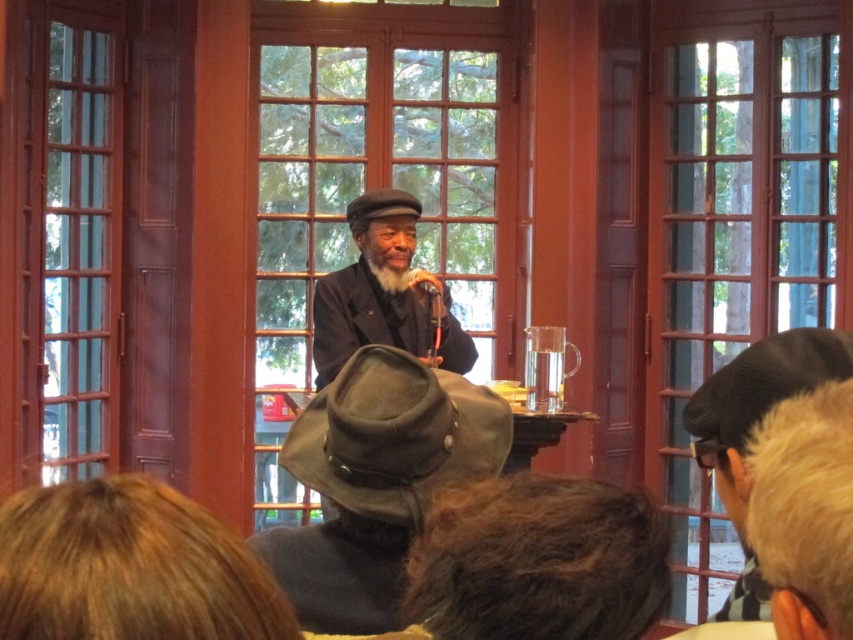
You are an event planner trying to set up a photo shoot for a promotional video. You need to place a camera so that both the matte black hat at center and the matte black microphone at center are visible in the frame. Based on their positions, which side of the microphone should you position the camera to capture both objects?

The matte black hat at center is positioned on the left side of the matte black microphone at center. To capture both in the frame, position the camera to the left side of the microphone so that the hat and microphone are both visible.

You are organizing a presentation and need to place a name tag on the table. The name tag is 10 cm wide. Can the matte black hat at center or the matte black microphone at center accommodate the name tag next to them without overlapping?

The matte black hat at center is wider than the matte black microphone at center. Since the name tag is 10 cm wide, it can fit next to either object, but there might be more space available next to the wider matte black hat at center.